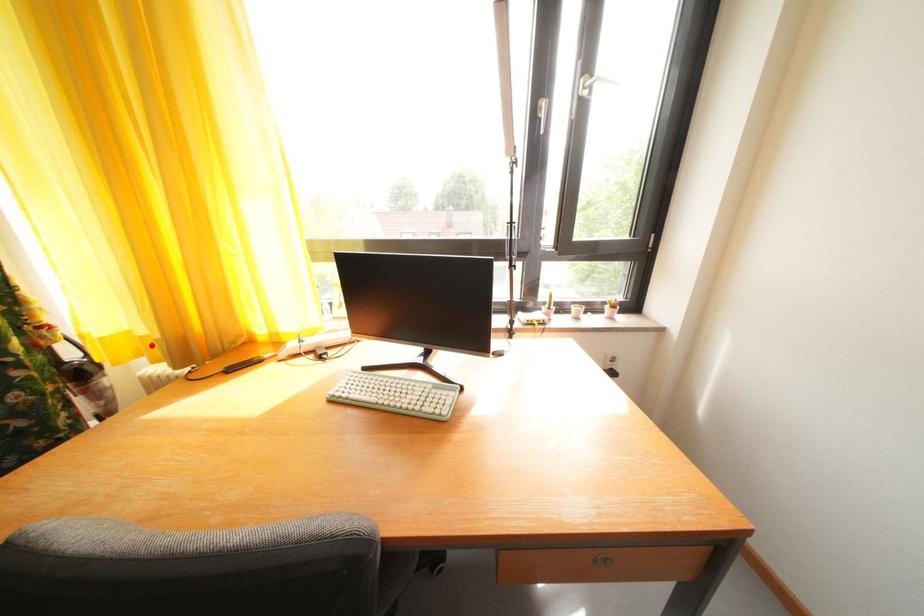
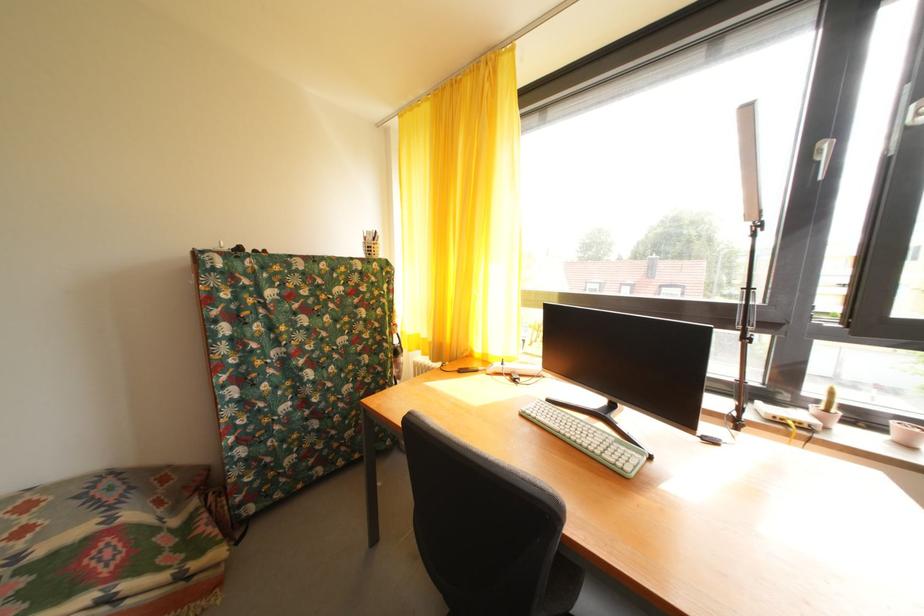
Locate, in the second image, the point that corresponds to the highlighted location in the first image.

(432, 346)